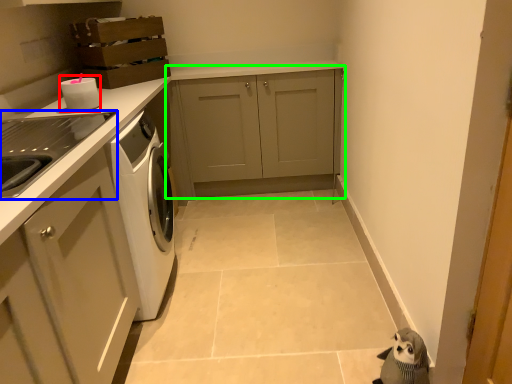
Question: Considering the real-world distances, which object is closest to appliance (highlighted by a red box)? home appliance (highlighted by a blue box) or cabinetry (highlighted by a green box).

Choices:
 (A) home appliance
 (B) cabinetry

Answer: (A)